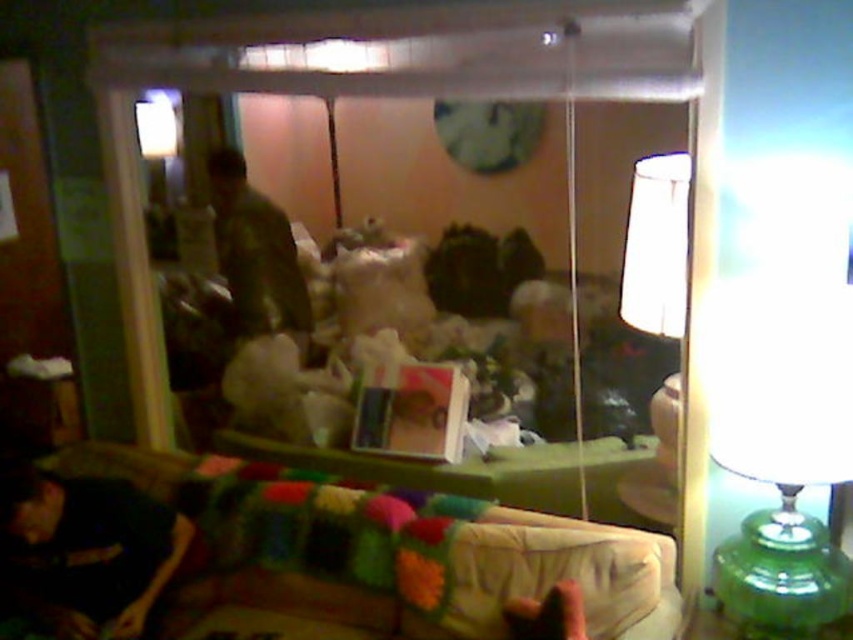
Question: Which point is farther from the camera taking this photo?

Choices:
 (A) (55, 520)
 (B) (395, 500)
 (C) (764, 394)

Answer: (B)

Question: Is multicolored knitted couch at lower center below dark fabric at lower left?

Choices:
 (A) yes
 (B) no

Answer: (A)

Question: Which point is farther from the camera taking this photo?

Choices:
 (A) (252, 620)
 (B) (77, 520)

Answer: (A)

Question: Which point is closer to the camera?

Choices:
 (A) dark fabric at lower left
 (B) multicolored knitted couch at lower center
 (C) green glass lamp at right

Answer: (C)

Question: Is green glass lamp at right positioned before dark fabric at lower left?

Choices:
 (A) no
 (B) yes

Answer: (B)

Question: Does green glass lamp at right appear over dark fabric at lower left?

Choices:
 (A) no
 (B) yes

Answer: (B)